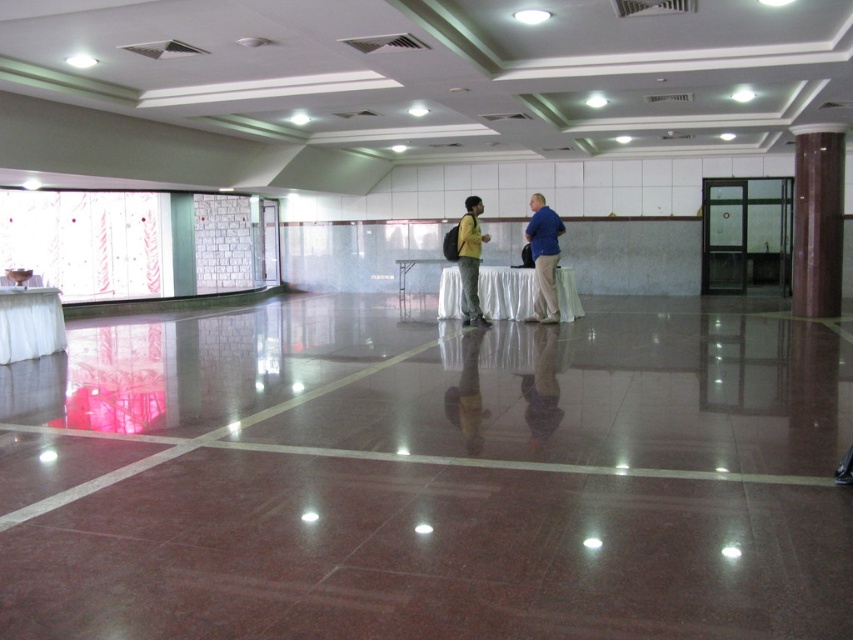
You are standing at the entrance of the hall and see the point marked at coordinates (543,257). What object is located at that point?

The yellow green fabric backpack at center is located at the point marked at coordinates (543,257).

From the picture: You are standing at the entrance of the hall and want to move towards the point at coordinates point (9, 294). There is an obstacle at point (555, 227). Will you encounter this obstacle before reaching your destination?

Point (9, 294) is in front of point (555, 227), so you will reach the destination before encountering the obstacle.

You are standing at the entrance of the hall and see the white cloth table at left. There is an emergency exit sign on the wall 26.91 feet away from the table. Can you walk straight from the table to the exit sign without any obstacles?

The distance between the white cloth table at left and the emergency exit sign is 26.91 feet, so yes, you can walk straight from the table to the exit sign without any obstacles as there is no mention of objects blocking the path.